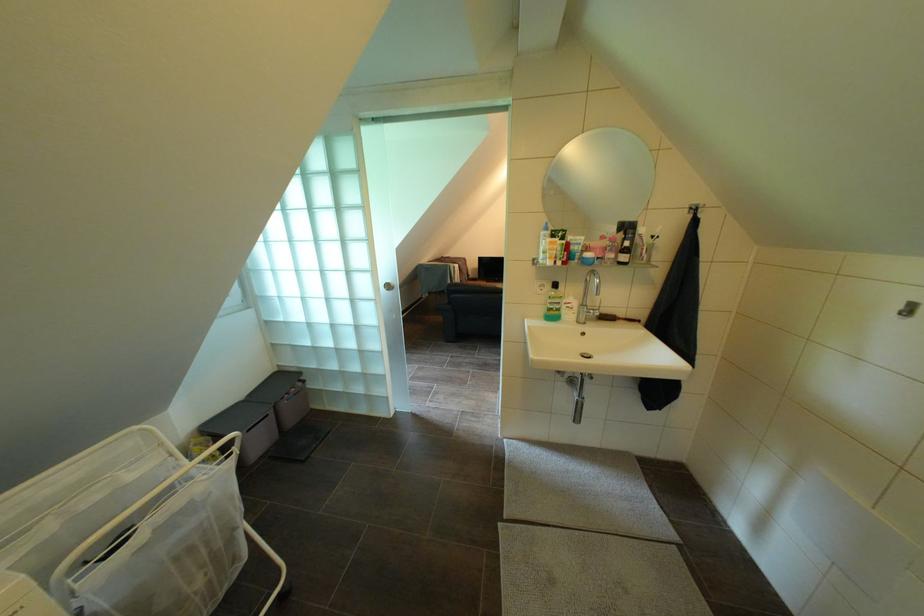
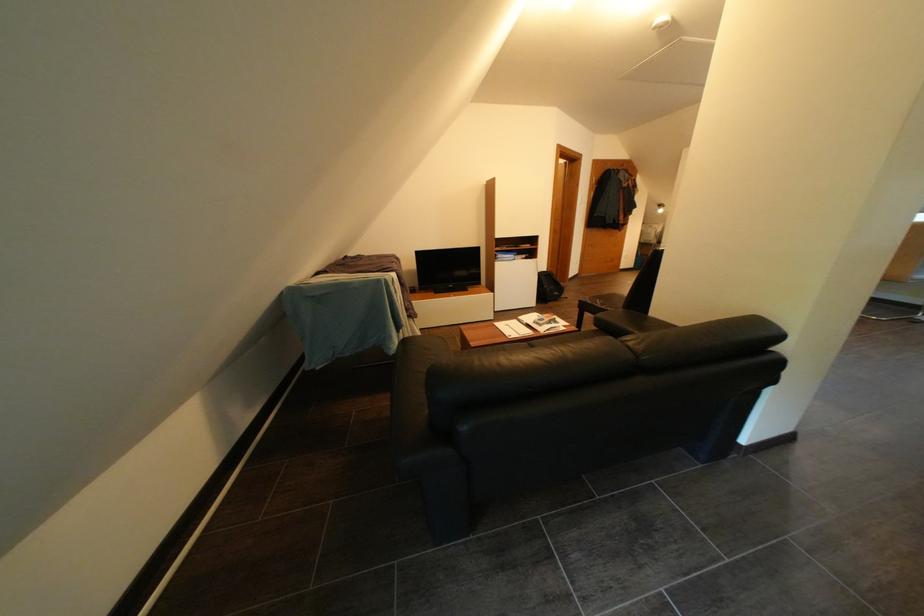
Question: The images are taken continuously from a first-person perspective. In which direction are you moving?

Choices:
 (A) Left
 (B) Right
 (C) Forward
 (D) Backward

Answer: (C)